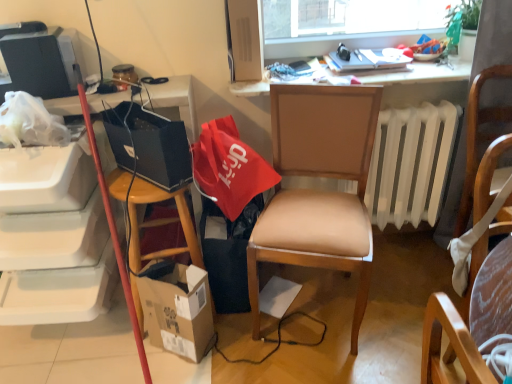
The width and height of the screenshot is (512, 384). Find the location of `free space in front of black fabric trash bin/can at lower center`. free space in front of black fabric trash bin/can at lower center is located at coordinates (259, 339).